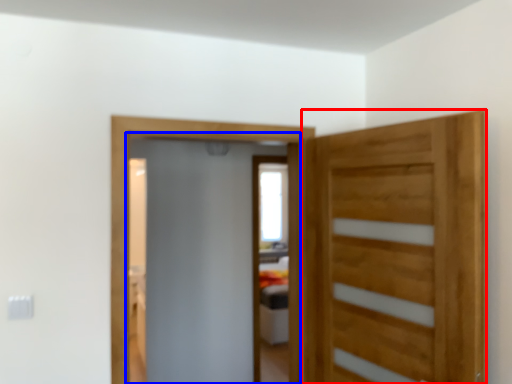
Question: Which of the following is the farthest to the observer, door (highlighted by a red box) or screen door (highlighted by a blue box)?

Choices:
 (A) door
 (B) screen door

Answer: (B)